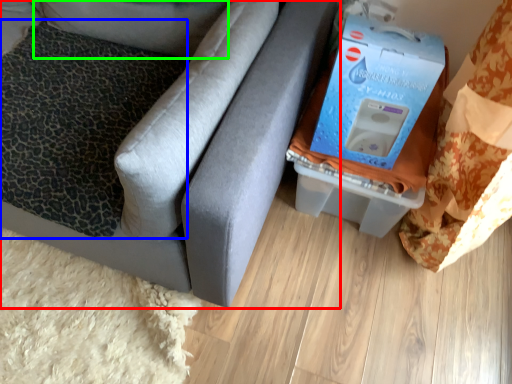
Question: Based on their relative distances, which object is nearer to furniture (highlighted by a red box)? Choose from pillow (highlighted by a blue box) and pillow (highlighted by a green box).

Choices:
 (A) pillow
 (B) pillow

Answer: (A)